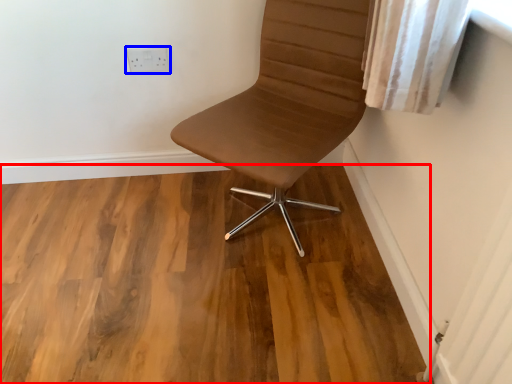
Question: Which object is further to the camera taking this photo, hardwood (highlighted by a red box) or electric outlet (highlighted by a blue box)?

Choices:
 (A) hardwood
 (B) electric outlet

Answer: (B)